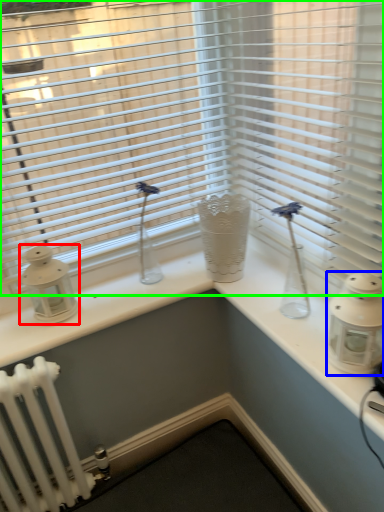
Question: Which is nearer to the candle holder (highlighted by a red box)? candle holder (highlighted by a blue box) or window blind (highlighted by a green box).

Choices:
 (A) candle holder
 (B) window blind

Answer: (B)